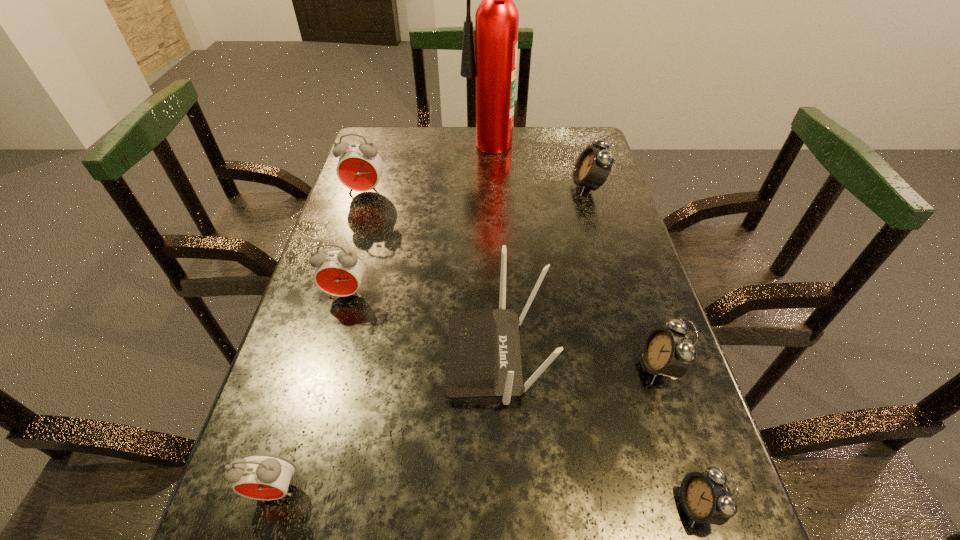
Image resolution: width=960 pixels, height=540 pixels. Identify the location of red fire extinguisher. (497, 18).

Find the location of a particular element. fire extinguisher is located at coordinates (497, 18).

Find the location of a particular element. the tallest alarm clock is located at coordinates (360, 166).

Locate an element on the screen. This screenshot has width=960, height=540. the biggest red alarm clock is located at coordinates coord(360,166).

The image size is (960, 540). I want to click on router, so click(x=483, y=357).

You are a GUI agent. You are given a task and a screenshot of the screen. Output one action in this format:
    pyautogui.click(x=<x>, y=<y>)
    Task: Click on the farthest white alarm clock
    
    Given the screenshot: What is the action you would take?
    pyautogui.click(x=593, y=166)

This screenshot has height=540, width=960. I want to click on the second nearest red alarm clock, so click(x=339, y=272).

Find the location of a particular element. the second biggest red alarm clock is located at coordinates (339, 272).

Locate an element on the screen. The image size is (960, 540). the second nearest white alarm clock is located at coordinates (667, 352).

Locate an element on the screen. This screenshot has width=960, height=540. the third nearest alarm clock is located at coordinates (667, 352).